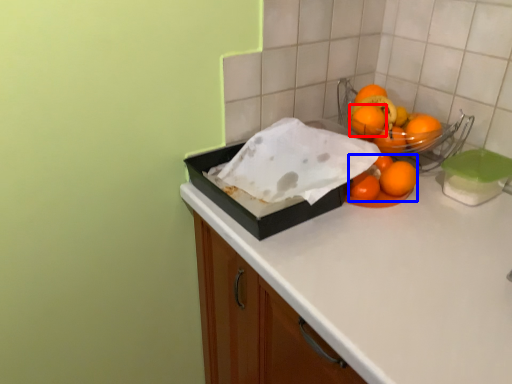
Question: Which object appears farthest to the camera in this image, orange (highlighted by a red box) or orange (highlighted by a blue box)?

Choices:
 (A) orange
 (B) orange

Answer: (A)